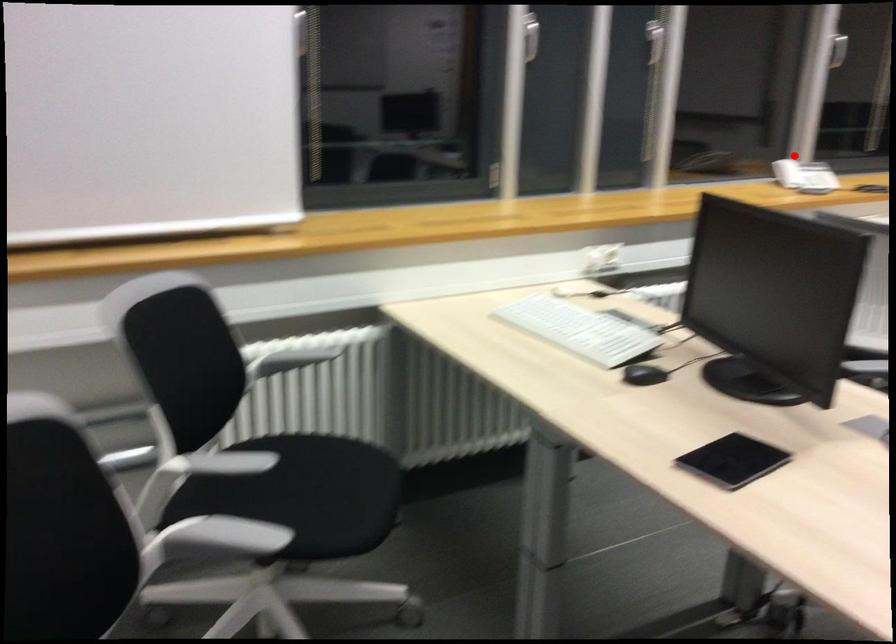
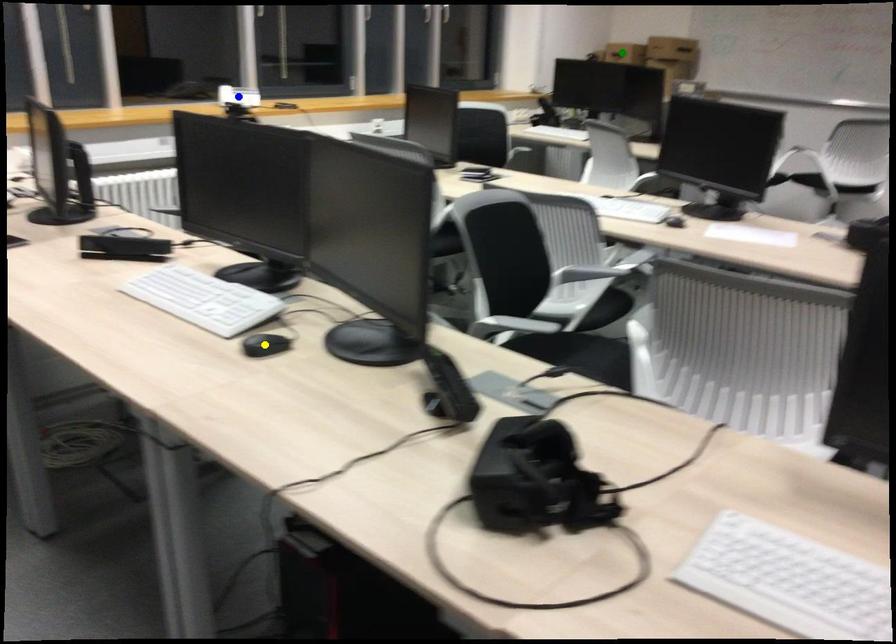
Question: I am providing you with two images of the same scene from different viewpoints. A red point is marked on the first image. You are given multiple points on the second image. Can you choose the point in image 2 that corresponds to the point in image 1?

Choices:
 (A) yellow point
 (B) blue point
 (C) green point

Answer: (B)